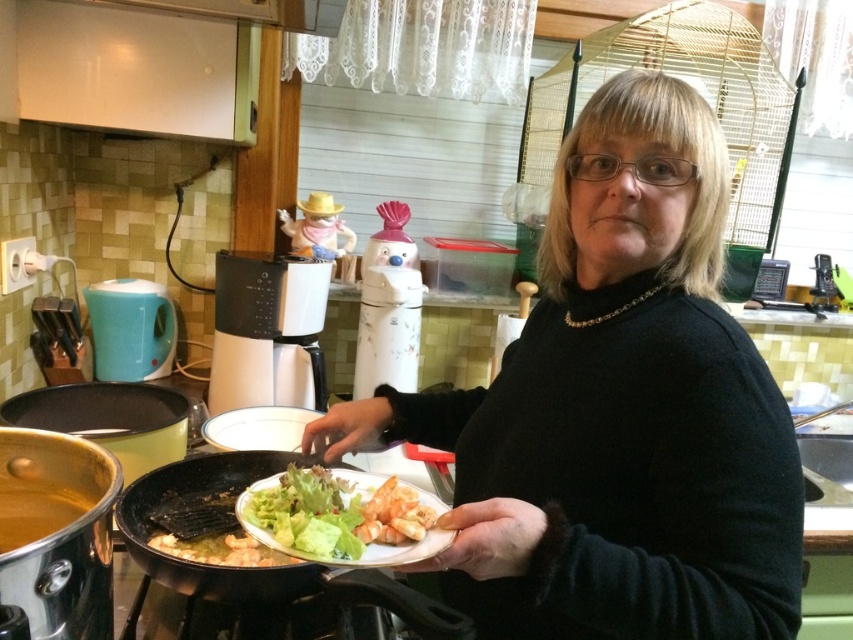
Does black matte sweater at center have a lesser height compared to fresh green salad at center?

Incorrect, black matte sweater at center's height does not fall short of fresh green salad at center's.

The width and height of the screenshot is (853, 640). What do you see at coordinates (616, 410) in the screenshot?
I see `black matte sweater at center` at bounding box center [616, 410].

At what (x,y) coordinates should I click in order to perform the action: click on black matte sweater at center. Please return your answer as a coordinate pair (x, y). This screenshot has width=853, height=640. Looking at the image, I should click on (616, 410).

Is fresh green salad at center positioned before black non-stick frying pan at lower center?

Yes, fresh green salad at center is closer to the viewer.

Can you confirm if fresh green salad at center is positioned below black non-stick frying pan at lower center?

Actually, fresh green salad at center is above black non-stick frying pan at lower center.

Does point (404, 483) lie behind point (172, 557)?

Yes, it is behind point (172, 557).

Identify the location of fresh green salad at center. (343, 516).

How far apart are black matte sweater at center and black non-stick frying pan at lower center?

black matte sweater at center and black non-stick frying pan at lower center are 14.72 inches apart.

Does black matte sweater at center have a greater width compared to black non-stick frying pan at lower center?

Yes.

Identify the location of black matte sweater at center. (616, 410).

What are the coordinates of `black matte sweater at center` in the screenshot? It's located at (616, 410).